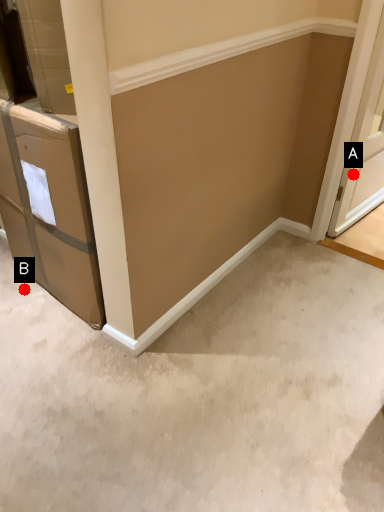
Question: Two points are circled on the image, labeled by A and B beside each circle. Which point is closer to the camera?

Choices:
 (A) A is closer
 (B) B is closer

Answer: (B)